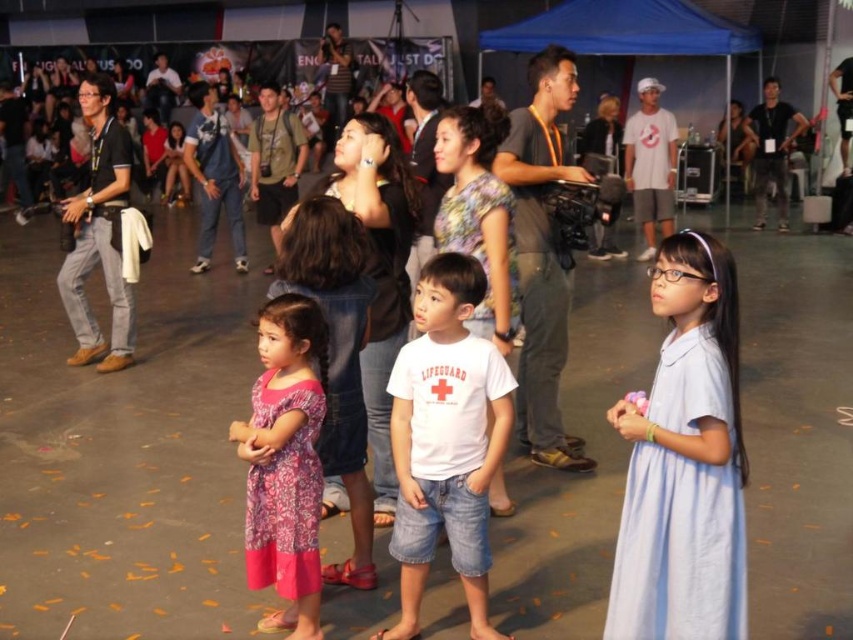
You are a photographer at the event and want to capture a clear photo of the pink floral dress at center without the light blue fabric dress at center blocking it. What should you do?

The light blue fabric dress at center is positioned over the pink floral dress at center, so you should move the light blue fabric dress at center to the side to ensure the pink floral dress at center is visible.